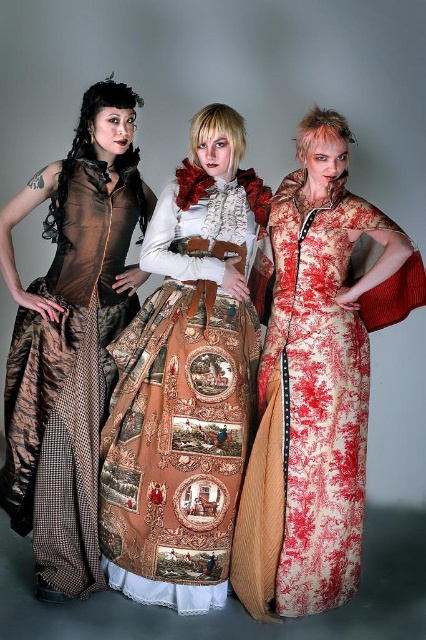
Question: Can you confirm if red toile dress at center is smaller than matte brown dress at left?

Choices:
 (A) no
 (B) yes

Answer: (B)

Question: Which point is closer to the camera?

Choices:
 (A) brown textured skirt at center
 (B) matte brown dress at left

Answer: (A)

Question: Which point appears farthest from the camera in this image?

Choices:
 (A) [351, 417]
 (B) [86, 417]

Answer: (B)

Question: Among these objects, which one is nearest to the camera?

Choices:
 (A) red toile dress at center
 (B) brown textured skirt at center
 (C) matte brown dress at left

Answer: (A)

Question: Can you confirm if brown textured skirt at center is wider than matte brown dress at left?

Choices:
 (A) no
 (B) yes

Answer: (B)

Question: Can you confirm if brown textured skirt at center is positioned below matte brown dress at left?

Choices:
 (A) yes
 (B) no

Answer: (A)